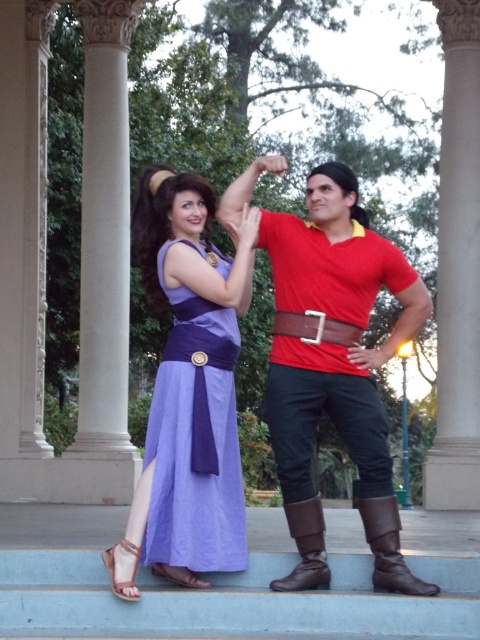
Question: Is brown leather boot at lower right in front of brown leather boot at lower center?

Choices:
 (A) yes
 (B) no

Answer: (A)

Question: Is purple satin dress at center to the right of brown leather boot at lower right from the viewer's perspective?

Choices:
 (A) no
 (B) yes

Answer: (A)

Question: Which object appears farthest from the camera in this image?

Choices:
 (A) purple satin dress at center
 (B) brown leather boot at lower right
 (C) brown leather belt at center

Answer: (C)

Question: Does matte red shirt at center have a lesser width compared to brown leather boot at lower right?

Choices:
 (A) no
 (B) yes

Answer: (A)

Question: Which of the following is the closest to the observer?

Choices:
 (A) (316, 529)
 (B) (410, 332)
 (C) (300, 326)
 (D) (180, 429)

Answer: (A)

Question: Among these objects, which one is farthest from the camera?

Choices:
 (A) brown leather belt at center
 (B) brown leather boot at lower center
 (C) purple satin dress at center

Answer: (A)